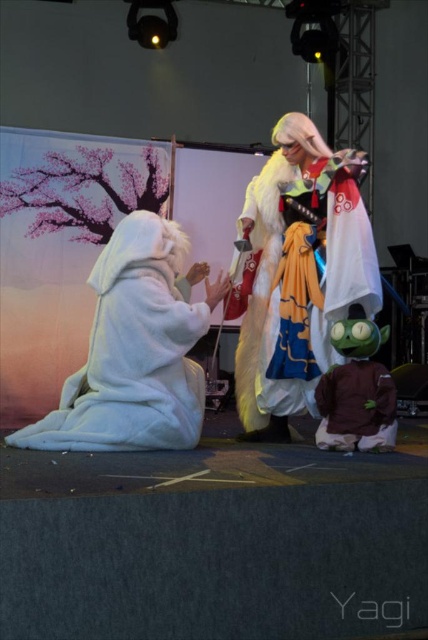
You are a photographer at the cosplay event and need to capture a photo that includes both the white fluffy robe at left and the multicolored fabric costume at center. Based on their positions, which costume should you ensure is closer to the left edge of your camera frame?

Result: The white fluffy robe at left should be closer to the left edge of the camera frame since it is positioned on the left side of the multicolored fabric costume at center.

You are an event photographer at the cosplay stage. You need to capture a photo that includes both the multicolored fabric costume at center and the brown plush toy at lower right. Based on their positions, which one should you adjust your camera focus to first to ensure both are in the frame?

The multicolored fabric costume at center is to the left of the brown plush toy at lower right, so you should focus on the brown plush toy at lower right first to ensure both are within the camera frame.